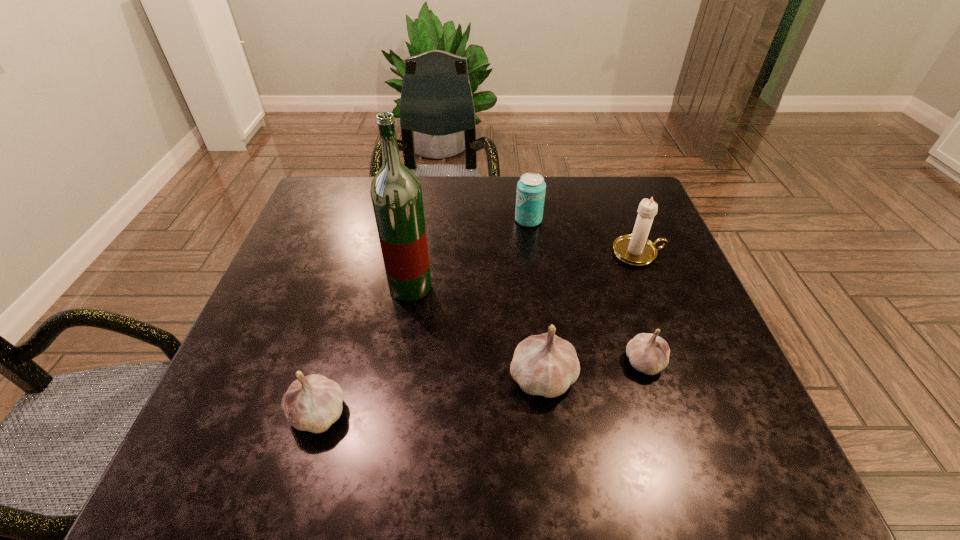
Locate an element on the screen. The image size is (960, 540). the leftmost object is located at coordinates (313, 403).

Where is `the leftmost garlic`? Image resolution: width=960 pixels, height=540 pixels. the leftmost garlic is located at coordinates (313, 403).

The height and width of the screenshot is (540, 960). I want to click on the tallest garlic, so click(546, 365).

At what (x,y) coordinates should I click in order to perform the action: click on the shortest garlic. Please return your answer as a coordinate pair (x, y). This screenshot has width=960, height=540. Looking at the image, I should click on (648, 353).

In order to click on the shortest object in this screenshot , I will do `click(648, 353)`.

Where is `liquor`? The height and width of the screenshot is (540, 960). liquor is located at coordinates (396, 193).

What are the coordinates of `the tallest object` in the screenshot? It's located at (396, 193).

Identify the location of the farthest object. (531, 188).

Where is `candle holder`? candle holder is located at coordinates (636, 249).

Locate an element on the screen. vacant region located 0.300m on the back of the tallest garlic is located at coordinates (528, 253).